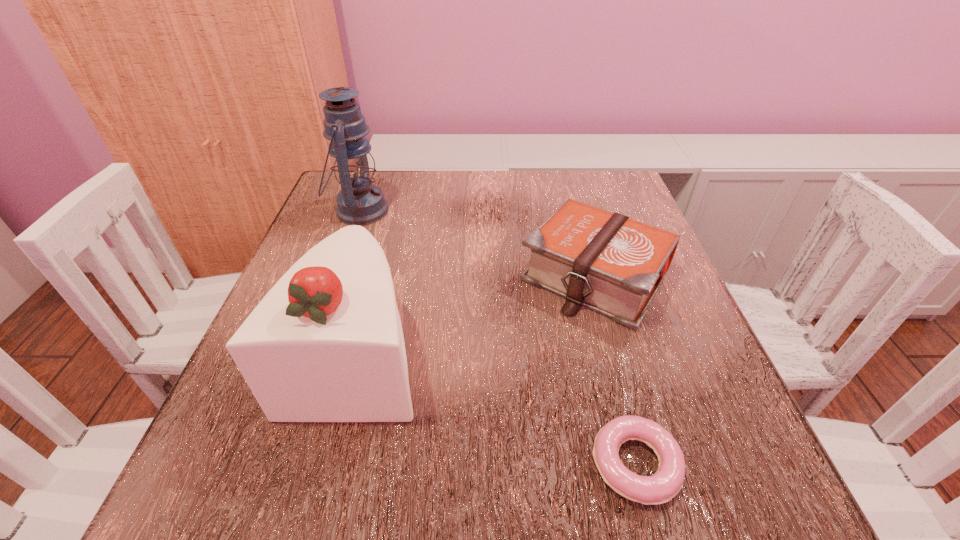
You are a GUI agent. You are given a task and a screenshot of the screen. Output one action in this format:
    pyautogui.click(x=<x>, y=<y>)
    Task: Click on the lantern
    
    Given the screenshot: What is the action you would take?
    pyautogui.click(x=359, y=202)

At what (x,y) coordinates should I click in order to perform the action: click on the third shortest object. Please return your answer as a coordinate pair (x, y). Looking at the image, I should click on (325, 344).

The image size is (960, 540). I want to click on Bible, so click(x=607, y=262).

Locate an element on the screen. The image size is (960, 540). the shortest object is located at coordinates point(661,487).

This screenshot has height=540, width=960. In order to click on doughnut in this screenshot , I will do `click(661, 487)`.

In order to click on vacant space located 0.360m on the front-facing side of the lantern in this screenshot , I will do `click(542, 211)`.

I want to click on free location located 0.060m on the front of the second tallest object, so click(x=329, y=464).

At what (x,y) coordinates should I click in order to perform the action: click on vacant space located on the front of the third tallest object. Please return your answer as a coordinate pair (x, y). Looking at the image, I should click on click(x=622, y=371).

Find the location of a particular element. vacant region located on the back of the doughnut is located at coordinates (581, 259).

Identify the location of object that is positioned at the far edge. (359, 202).